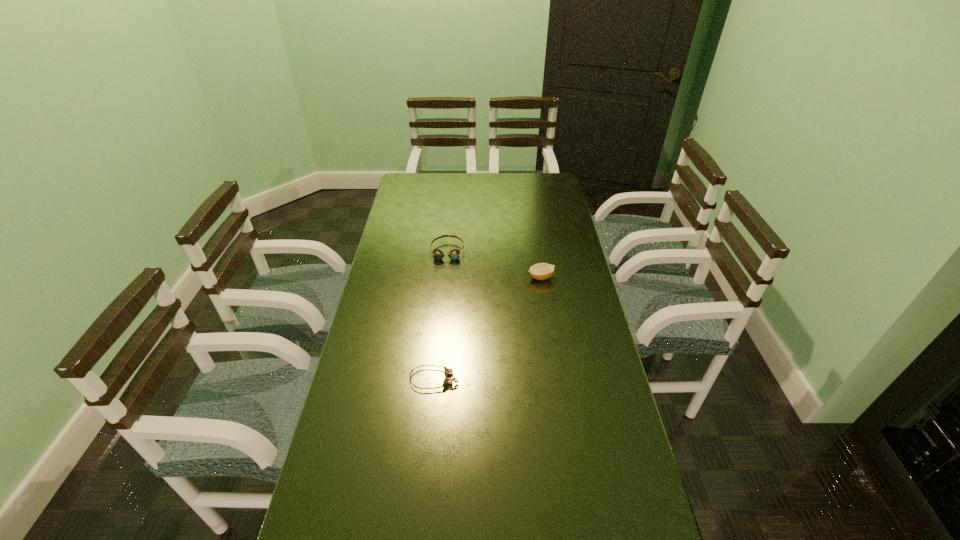
The width and height of the screenshot is (960, 540). I want to click on lemon, so click(x=541, y=271).

Image resolution: width=960 pixels, height=540 pixels. Identify the location of the second farthest object. (541, 271).

This screenshot has height=540, width=960. I want to click on the farther goggles, so click(x=454, y=254).

Identify the location of the taller goggles. The width and height of the screenshot is (960, 540). (454, 254).

Find the location of a particular element. The width and height of the screenshot is (960, 540). the shortest object is located at coordinates pos(448,372).

Locate an element on the screen. the nearest object is located at coordinates (448, 372).

What are the coordinates of `vacant space located on the back of the lemon` in the screenshot? It's located at (535, 240).

Locate an element on the screen. The width and height of the screenshot is (960, 540). vacant space located through the lenses of the farthest object is located at coordinates (444, 284).

The height and width of the screenshot is (540, 960). I want to click on vacant space located on the front lenses and sides of the shortest object, so click(551, 379).

Identify the location of object present at the right edge. This screenshot has width=960, height=540. (541, 271).